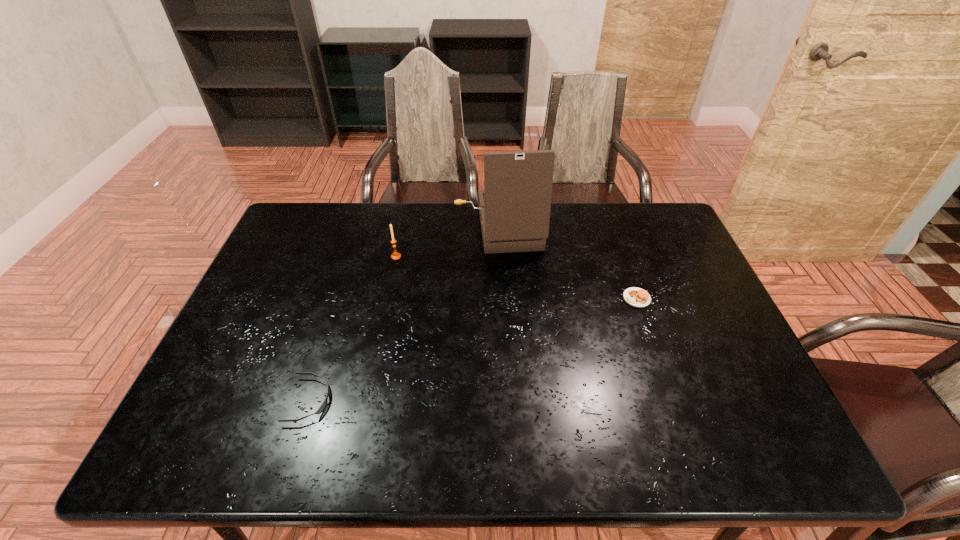
Select which object is the closest to the third object from left to right. Please provide its 2D coordinates. Your answer should be formatted as a tuple, i.e. [(x, y)], where the tuple contains the x and y coordinates of a point satisfying the conditions above.

[(395, 255)]

Identify the location of the third closest object to the sunglasses. The height and width of the screenshot is (540, 960). (636, 297).

Image resolution: width=960 pixels, height=540 pixels. I want to click on vacant space that satisfies the following two spatial constraints: 1. on the back side of the third object from left to right; 2. on the left side of the second tallest object, so click(x=402, y=228).

Locate an element on the screen. The width and height of the screenshot is (960, 540). free region that satisfies the following two spatial constraints: 1. on the front side of the third object from right to left; 2. on the front-facing side of the nearest object is located at coordinates (367, 400).